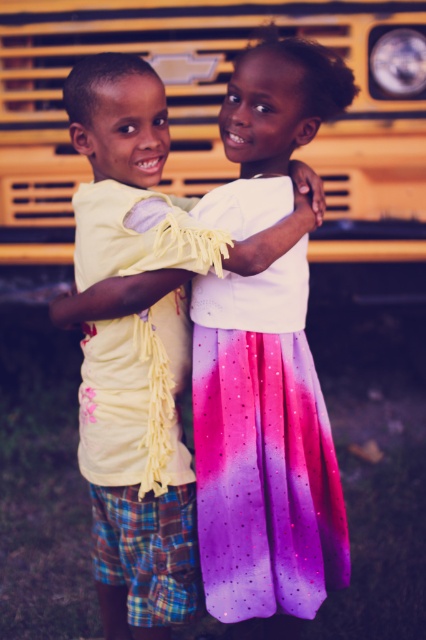
You are a photographer trying to capture a clear photo of both the matte yellow shirt at center and the shiny ombre skirt at center. Since the camera can only focus on one object at a time, which object should you choose to ensure the larger one is in focus?

The matte yellow shirt at center has a larger size compared to the shiny ombre skirt at center, so you should focus on the matte yellow shirt at center to ensure the larger one is in focus.

You are a photographer trying to capture a clear photo of both the matte yellow shirt at center and the shiny ombre skirt at center. Given that your camera has a depth of field that can focus on objects within a 1.5 inches range, will both objects be in focus?

The distance between the matte yellow shirt at center and the shiny ombre skirt at center is 1.55 inches. Since the camera can focus on objects within a 1.5 inches range, the 1.55 inches distance exceeds this limit, so both objects cannot be in focus simultaneously.

You are a photographer standing 2 meters away from the camera. You want to take a photo of the matte yellow shirt at center. Can you reach the shirt without moving your position?

The matte yellow shirt at center is 1.96 meters away from the camera. Since you are standing 2 meters away from the camera, you are approximately 3.96 meters away from the shirt. Therefore, you cannot reach the shirt without moving closer.